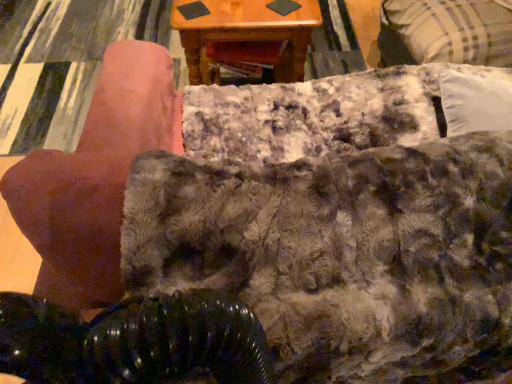
At what (x,y) coordinates should I click in order to perform the action: click on wooden table at upper center. Please return your answer as a coordinate pair (x, y). Looking at the image, I should click on (245, 35).

What do you see at coordinates (245, 35) in the screenshot? I see `wooden table at upper center` at bounding box center [245, 35].

The width and height of the screenshot is (512, 384). In order to click on wooden table at upper center in this screenshot , I will do `click(245, 35)`.